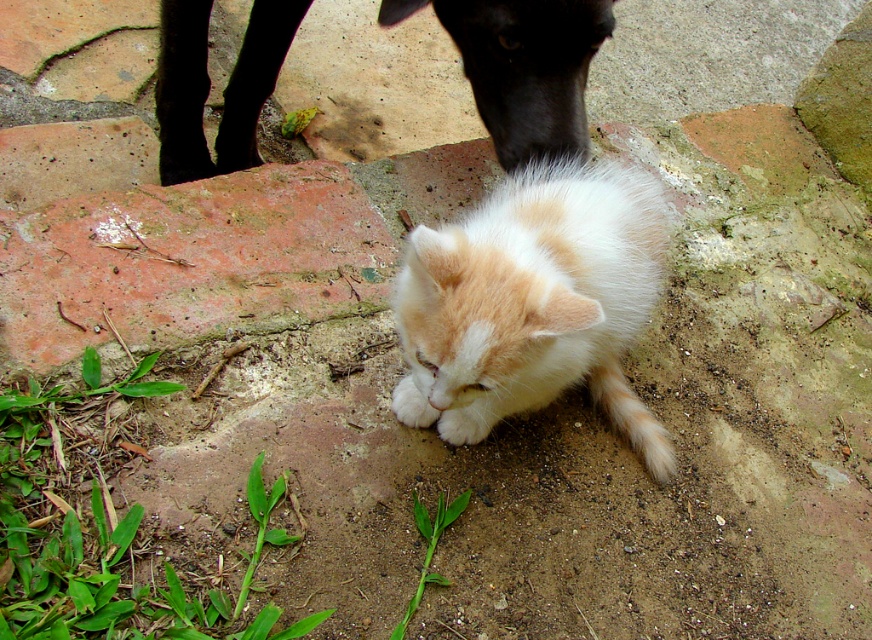
Is point (426, 344) less distant than point (404, 392)?

Yes, point (426, 344) is closer to viewer.

This screenshot has width=872, height=640. Describe the element at coordinates (539, 296) in the screenshot. I see `fluffy orange-white cat at center` at that location.

This screenshot has width=872, height=640. Identify the location of fluffy orange-white cat at center. (539, 296).

Is point (489, 262) more distant than point (471, 432)?

That is False.

Which is in front, point (540, 189) or point (439, 428)?

Positioned in front is point (540, 189).

Find the location of `fluffy orange-white cat at center`. fluffy orange-white cat at center is located at coordinates (539, 296).

Consider the image. Is the position of white fluffy paw at center less distant than that of white fluffy paw at lower center?

That is True.

Which is behind, point (469, 442) or point (428, 424)?

Positioned behind is point (428, 424).

The image size is (872, 640). In order to click on white fluffy paw at center in this screenshot , I will do `click(465, 422)`.